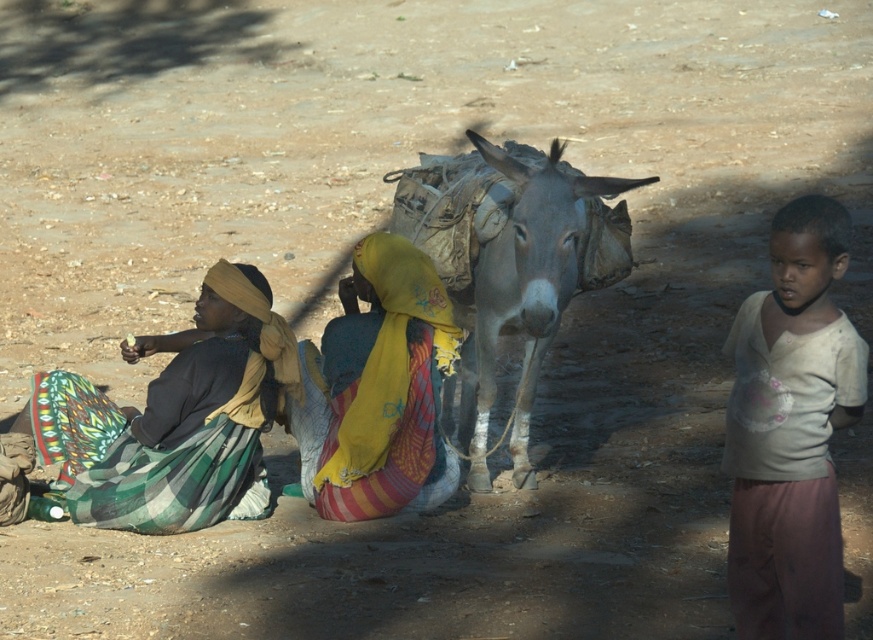
Can you confirm if light beige cotton shirt at right is bigger than gray textured donkey at center?

Actually, light beige cotton shirt at right might be smaller than gray textured donkey at center.

Who is taller, light beige cotton shirt at right or gray textured donkey at center?

Standing taller between the two is gray textured donkey at center.

Is point (841, 355) closer to camera compared to point (480, 452)?

Yes.

The width and height of the screenshot is (873, 640). Identify the location of light beige cotton shirt at right. (791, 429).

How much distance is there between light beige cotton shirt at right and yellow fabric headscarf at center?

They are 2.72 meters apart.

Who is higher up, light beige cotton shirt at right or yellow fabric headscarf at center?

Positioned higher is yellow fabric headscarf at center.

This screenshot has width=873, height=640. Describe the element at coordinates (791, 429) in the screenshot. I see `light beige cotton shirt at right` at that location.

You are a GUI agent. You are given a task and a screenshot of the screen. Output one action in this format:
    pyautogui.click(x=<x>, y=<y>)
    Task: Click on the light beige cotton shirt at right
    
    Given the screenshot: What is the action you would take?
    pyautogui.click(x=791, y=429)

Does matte yellow headscarf at left lie in front of gray textured donkey at center?

No, it is behind gray textured donkey at center.

Between matte yellow headscarf at left and gray textured donkey at center, which one is positioned lower?

matte yellow headscarf at left is below.

Is point (232, 289) more distant than point (550, 150)?

Yes, it is behind point (550, 150).

At what (x,y) coordinates should I click in order to perform the action: click on matte yellow headscarf at left. Please return your answer as a coordinate pair (x, y). This screenshot has height=640, width=873. Looking at the image, I should click on (176, 420).